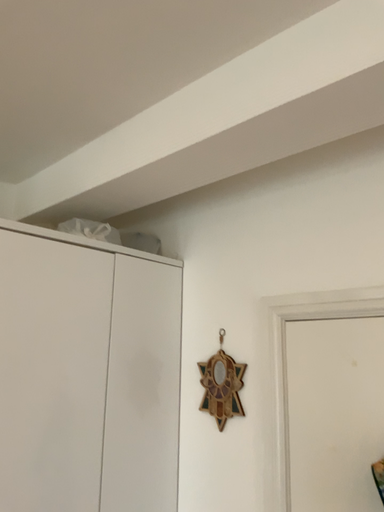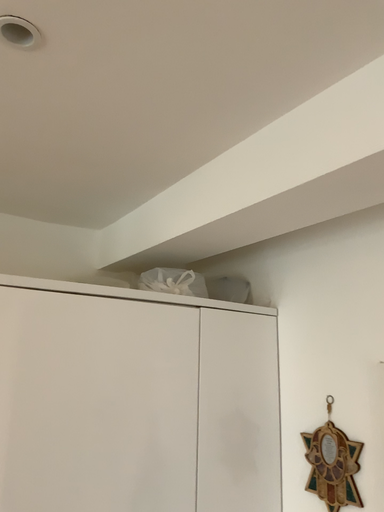
Question: How did the camera likely rotate when shooting the video?

Choices:
 (A) rotated right
 (B) rotated left

Answer: (B)